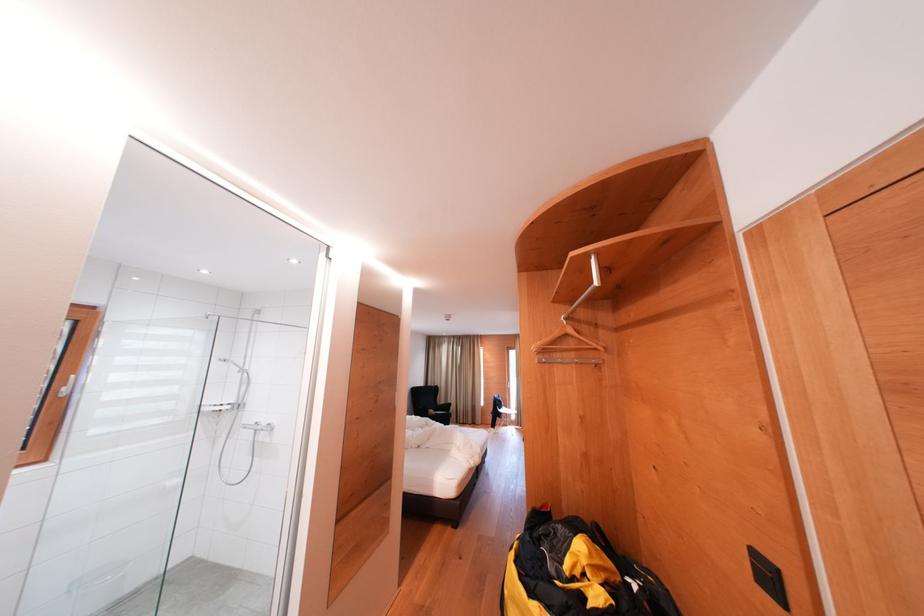
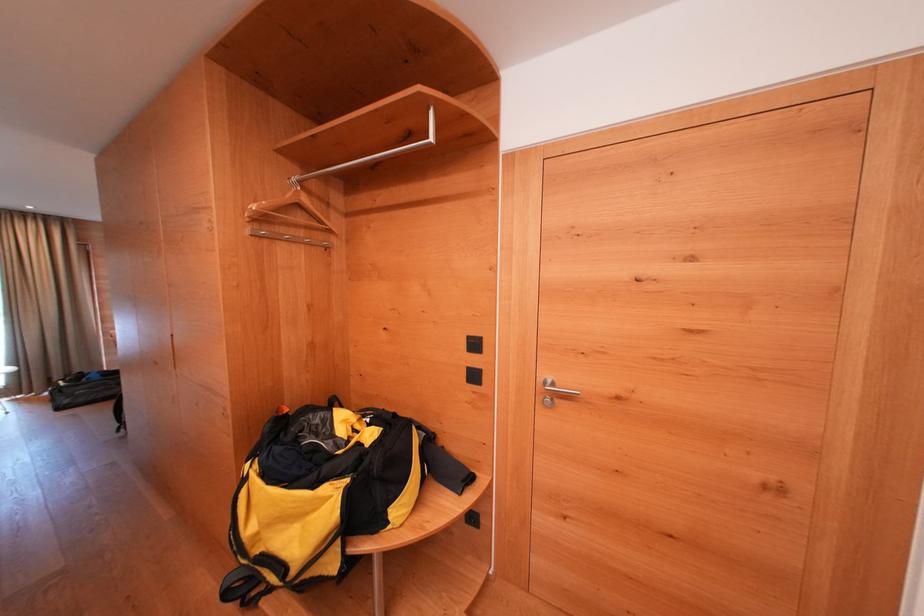
Question: Based on the continuous images, in which direction is the camera rotating? Reply with the corresponding letter.

Choices:
 (A) Left
 (B) Right
 (C) Up
 (D) Down

Answer: (B)